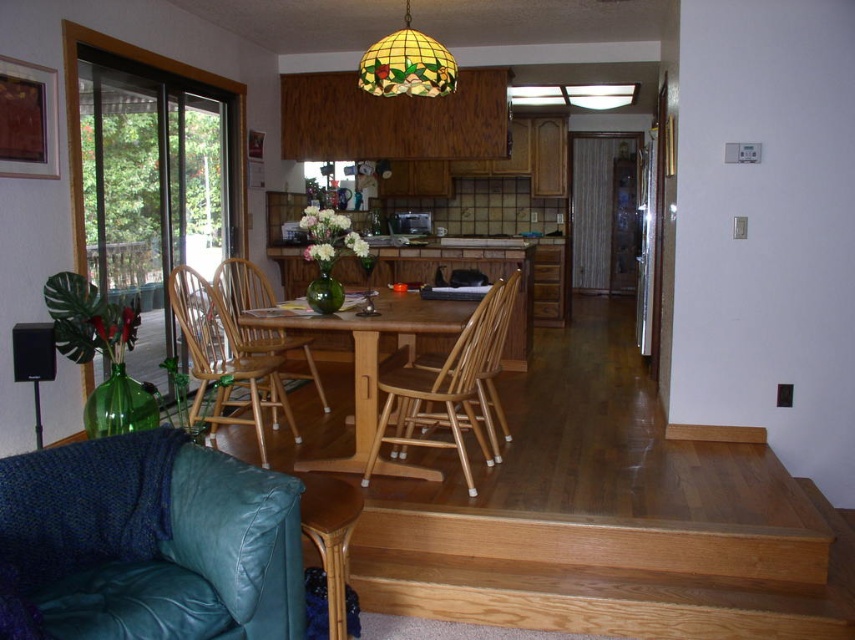
Question: Which point is closer to the camera?

Choices:
 (A) (447, 92)
 (B) (158, 474)
 (C) (453, 406)
 (D) (257, 348)

Answer: (B)

Question: Where is green leather couch at lower left located in relation to wooden table at center in the image?

Choices:
 (A) below
 (B) above

Answer: (A)

Question: Among these points, which one is farthest from the camera?

Choices:
 (A) (413, 412)
 (B) (21, 508)

Answer: (A)

Question: Is green leather couch at lower left to the right of wooden chair at center from the viewer's perspective?

Choices:
 (A) yes
 (B) no

Answer: (B)

Question: Estimate the real-world distances between objects in this image. Which object is closer to the wooden table at center?

Choices:
 (A) green leather couch at lower left
 (B) woven wood chair at center
 (C) stained glass lampshade at upper center

Answer: (B)

Question: Where is green leather couch at lower left located in relation to beech wood armchair at center in the image?

Choices:
 (A) above
 (B) below

Answer: (B)